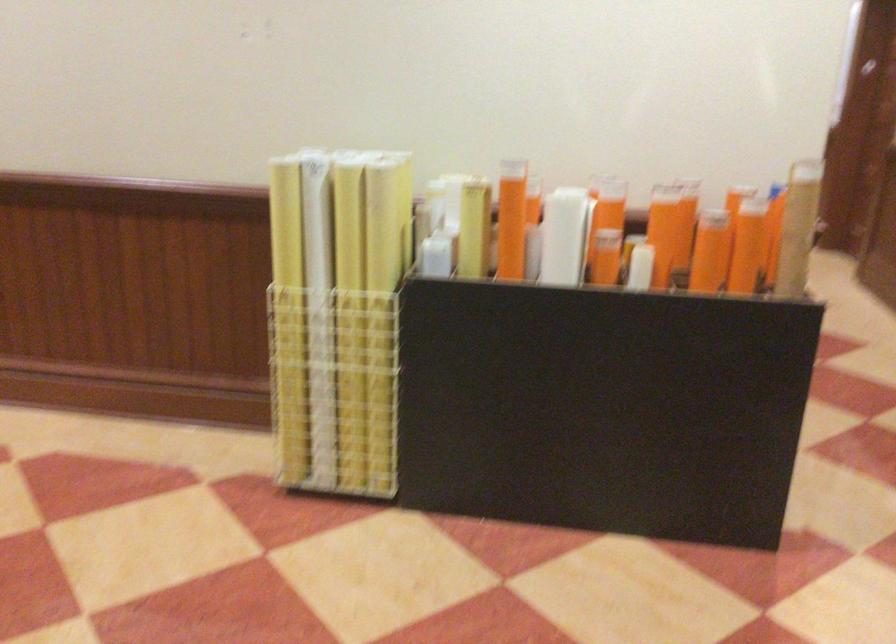
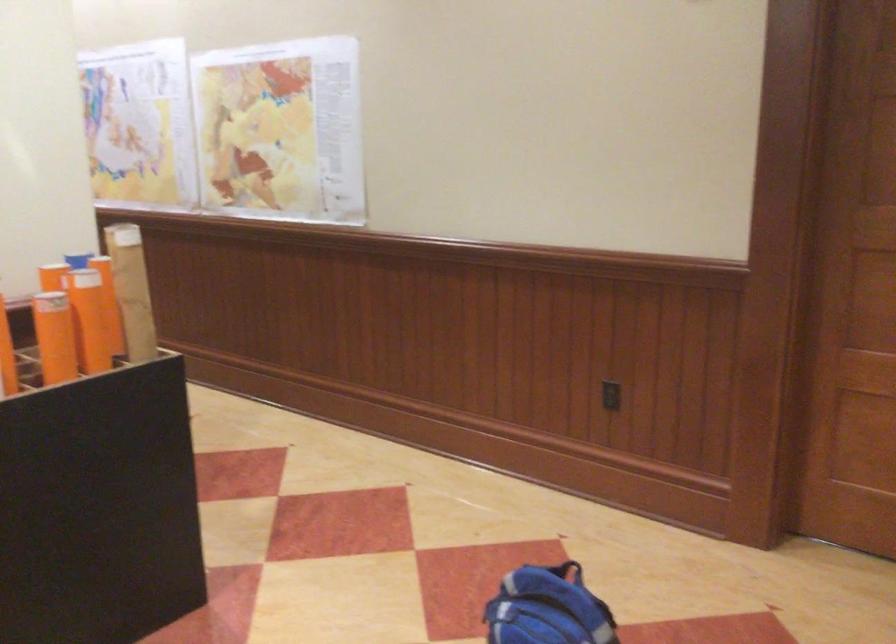
Question: The images are taken continuously from a first-person perspective. In which direction is your viewpoint rotating?

Choices:
 (A) Left
 (B) Right
 (C) Up
 (D) Down

Answer: (B)